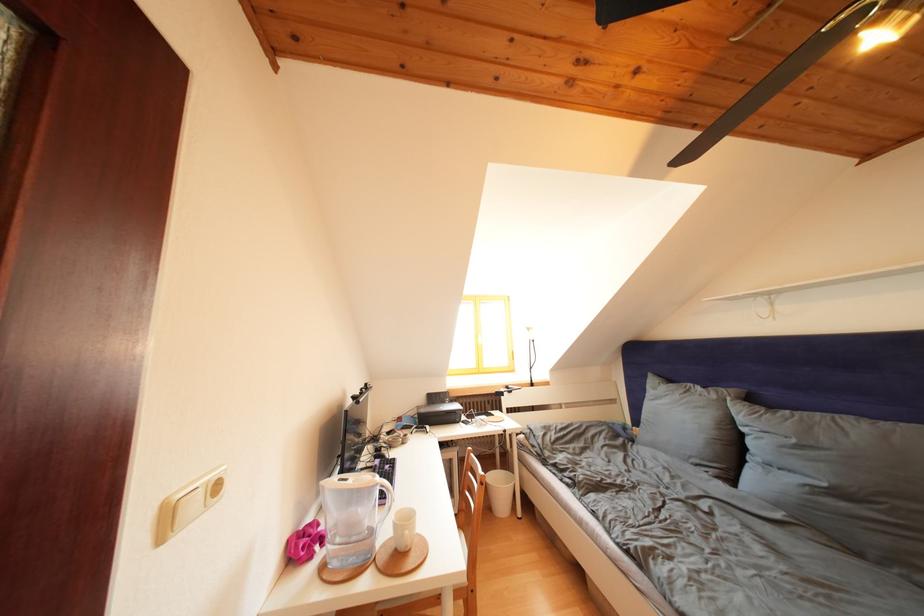
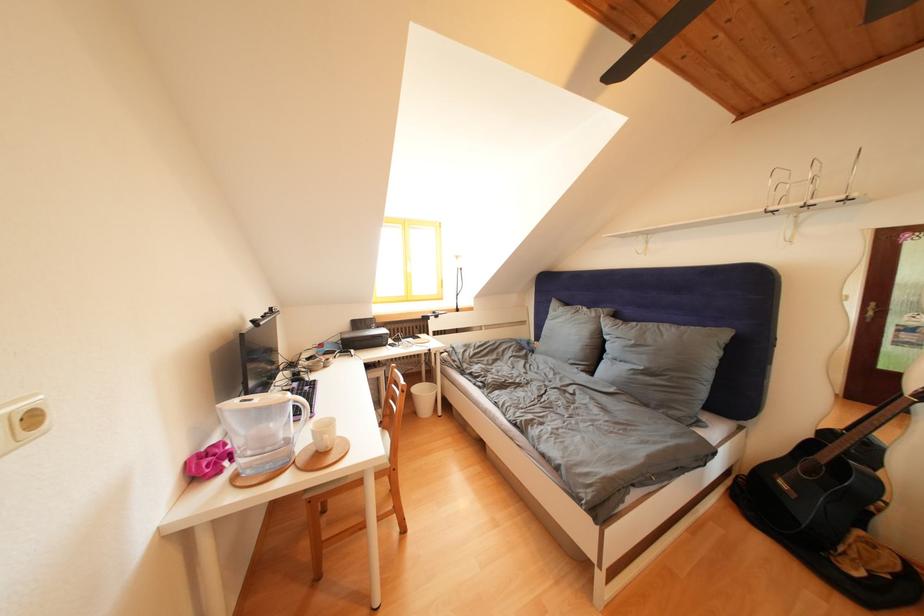
The point at (225,492) is marked in the first image. Where is the corresponding point in the second image?

(41, 424)